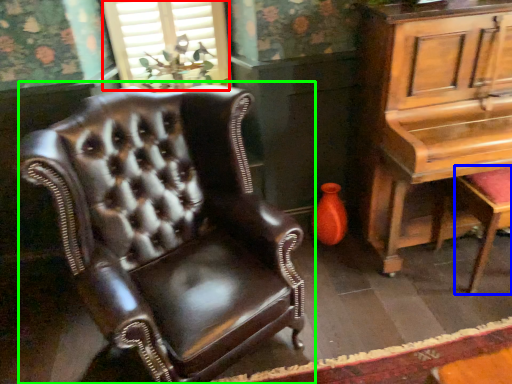
Question: Based on their relative distances, which object is farther from window (highlighted by a red box)? Choose from music stool (highlighted by a blue box) and chair (highlighted by a green box).

Choices:
 (A) music stool
 (B) chair

Answer: (A)